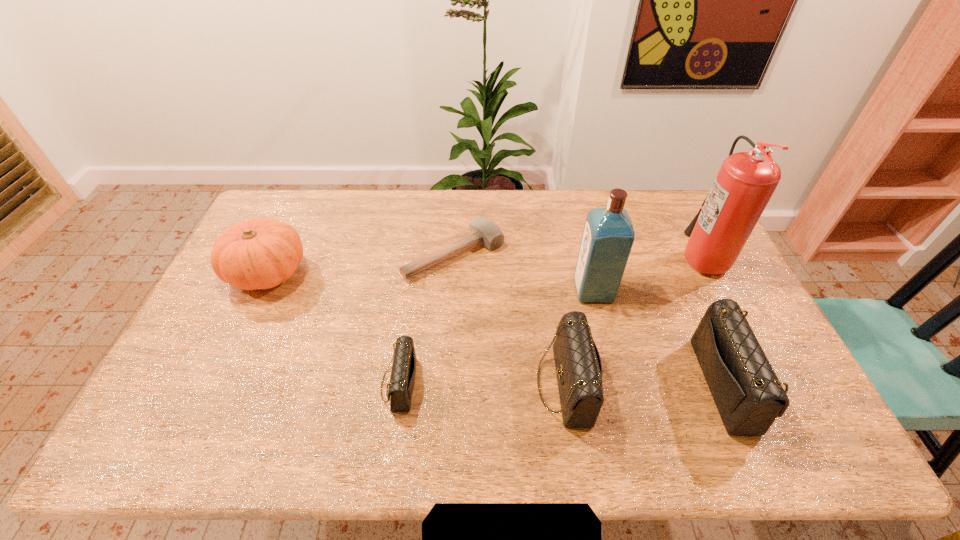
With all clutch bags evenly spaced, where should an extra clutch bag be placed on the left to continue the pattern? Please point out a vacant space. Please provide its 2D coordinates. Your answer should be formatted as a tuple, i.e. [(x, y)], where the tuple contains the x and y coordinates of a point satisfying the conditions above.

[(235, 384)]